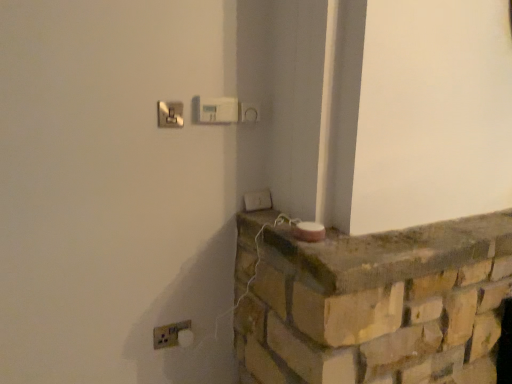
At what (x,y) coordinates should I click in order to perform the action: click on rustic stone ledge at center. Please return your answer as a coordinate pair (x, y). Image resolution: width=512 pixels, height=384 pixels. Looking at the image, I should click on (392, 252).

Find the location of a particular element. white plastic light switch at upper center, which is the first light switch from top to bottom is located at coordinates (217, 110).

What are the coordinates of `matte silver switch at upper center, acting as the 1th light switch starting from the front` in the screenshot? It's located at (170, 114).

The width and height of the screenshot is (512, 384). What do you see at coordinates (257, 200) in the screenshot?
I see `white plastic light switch at lower center, positioned as the first light switch in right-to-left order` at bounding box center [257, 200].

The image size is (512, 384). I want to click on white plastic electric outlet at lower left, so click(169, 334).

From the image's perspective, is matte silver switch at upper center, the 1th light switch in the left-to-right sequence, on white plastic electric outlet at lower left?

Correct, matte silver switch at upper center, the 1th light switch in the left-to-right sequence, appears higher than white plastic electric outlet at lower left in the image.

What's the angular difference between matte silver switch at upper center, the 3th light switch viewed from the right, and white plastic electric outlet at lower left's facing directions?

0.0309 degrees.

Which is behind, point (182, 110) or point (163, 327)?

Point (163, 327)

Does matte silver switch at upper center, which appears as the 3th light switch when viewed from the back, touch white plastic electric outlet at lower left?

There is a gap between matte silver switch at upper center, which appears as the 3th light switch when viewed from the back, and white plastic electric outlet at lower left.

From the image's perspective, would you say white plastic electric outlet at lower left is shown under white plastic light switch at upper center, which is the third light switch in bottom-to-top order?

Yes, from the image's perspective, white plastic electric outlet at lower left is beneath white plastic light switch at upper center, which is the third light switch in bottom-to-top order.

Is white plastic electric outlet at lower left inside or outside of white plastic light switch at upper center, placed as the second light switch when sorted from front to back?

white plastic electric outlet at lower left lies outside white plastic light switch at upper center, placed as the second light switch when sorted from front to back.

How much distance is there between white plastic electric outlet at lower left and white plastic light switch at upper center, which ranks as the second light switch in back-to-front order?

A distance of 32.73 inches exists between white plastic electric outlet at lower left and white plastic light switch at upper center, which ranks as the second light switch in back-to-front order.

From a real-world perspective, is white plastic electric outlet at lower left under white plastic light switch at upper center, which is the second light switch in right-to-left order?

Yes, from a real-world perspective, white plastic electric outlet at lower left is below white plastic light switch at upper center, which is the second light switch in right-to-left order.

Which is behind, point (165, 104) or point (347, 282)?

Point (165, 104)

Which is behind, matte silver switch at upper center, the 1th light switch in the left-to-right sequence, or rustic stone ledge at center?

matte silver switch at upper center, the 1th light switch in the left-to-right sequence, is more distant.

Is matte silver switch at upper center, the 3th light switch viewed from the right, not within rustic stone ledge at center?

Yes, matte silver switch at upper center, the 3th light switch viewed from the right, is located beyond the bounds of rustic stone ledge at center.

From a real-world perspective, is matte silver switch at upper center, the 1th light switch in the left-to-right sequence, over rustic stone ledge at center?

Correct, in the physical world, matte silver switch at upper center, the 1th light switch in the left-to-right sequence, is higher than rustic stone ledge at center.

Is white plastic light switch at lower center, the 1th light switch positioned from the bottom, wider than rustic stone ledge at center?

Incorrect, the width of white plastic light switch at lower center, the 1th light switch positioned from the bottom, does not surpass that of rustic stone ledge at center.

Would you say white plastic light switch at lower center, marked as the 3th light switch in a top-to-bottom arrangement, contains rustic stone ledge at center?

No, rustic stone ledge at center is not surrounded by white plastic light switch at lower center, marked as the 3th light switch in a top-to-bottom arrangement.

From the picture: Which is more distant, (244, 208) or (289, 266)?

The point (244, 208) is farther from the camera.

Is white plastic light switch at lower center, the 1th light switch positioned from the bottom, far away from rustic stone ledge at center?

No.

Does white plastic light switch at upper center, which is the third light switch in bottom-to-top order, appear on the left side of rustic stone ledge at center?

Correct, you'll find white plastic light switch at upper center, which is the third light switch in bottom-to-top order, to the left of rustic stone ledge at center.

From a real-world perspective, is white plastic light switch at upper center, which is the third light switch in bottom-to-top order, over rustic stone ledge at center?

Correct, in the physical world, white plastic light switch at upper center, which is the third light switch in bottom-to-top order, is higher than rustic stone ledge at center.

Is white plastic light switch at upper center, which is the second light switch in right-to-left order, aimed at rustic stone ledge at center?

No, white plastic light switch at upper center, which is the second light switch in right-to-left order, is not aimed at rustic stone ledge at center.

From a real-world perspective, is white plastic electric outlet at lower left positioned above or below matte silver switch at upper center, the 3th light switch viewed from the right?

white plastic electric outlet at lower left is situated lower than matte silver switch at upper center, the 3th light switch viewed from the right, in the real world.

Is white plastic electric outlet at lower left aimed at matte silver switch at upper center, the second light switch from the top?

No, white plastic electric outlet at lower left does not turn towards matte silver switch at upper center, the second light switch from the top.

Considering the points (180, 324) and (160, 119), which point is in front, point (180, 324) or point (160, 119)?

Point (160, 119)

From the image's perspective, does white plastic light switch at lower center, acting as the 3th light switch starting from the left, appear lower than matte silver switch at upper center, the second light switch from the top?

Correct, white plastic light switch at lower center, acting as the 3th light switch starting from the left, appears lower than matte silver switch at upper center, the second light switch from the top, in the image.

Is the position of white plastic light switch at lower center, the 1th light switch positioned from the bottom, more distant than that of matte silver switch at upper center, which appears as the 3th light switch when viewed from the back?

Yes, the depth of white plastic light switch at lower center, the 1th light switch positioned from the bottom, is greater than that of matte silver switch at upper center, which appears as the 3th light switch when viewed from the back.

Which is correct: white plastic light switch at lower center, acting as the 3th light switch starting from the left, is inside matte silver switch at upper center, the second light switch from the top, or outside of it?

white plastic light switch at lower center, acting as the 3th light switch starting from the left, exists outside the volume of matte silver switch at upper center, the second light switch from the top.

Are white plastic light switch at lower center, acting as the 3th light switch starting from the left, and matte silver switch at upper center, acting as the 1th light switch starting from the front, far apart?

white plastic light switch at lower center, acting as the 3th light switch starting from the left, is actually quite close to matte silver switch at upper center, acting as the 1th light switch starting from the front.

This screenshot has width=512, height=384. Find the location of `electric outlet behind the matte silver switch at upper center, acting as the 1th light switch starting from the front`. electric outlet behind the matte silver switch at upper center, acting as the 1th light switch starting from the front is located at coordinates (169, 334).

Where is `electric outlet below the white plastic light switch at upper center, which ranks as the second light switch in back-to-front order (from the image's perspective)`? This screenshot has width=512, height=384. electric outlet below the white plastic light switch at upper center, which ranks as the second light switch in back-to-front order (from the image's perspective) is located at coordinates (169, 334).

Which object lies further to the anchor point rustic stone ledge at center, matte silver switch at upper center, the 3th light switch viewed from the right, or white plastic electric outlet at lower left?

matte silver switch at upper center, the 3th light switch viewed from the right, lies further to rustic stone ledge at center than the other object.

When comparing their distances from white plastic light switch at lower center, acting as the 3th light switch starting from the left, does white plastic electric outlet at lower left or white plastic light switch at upper center, placed as the second light switch when sorted from front to back, seem further?

Based on the image, white plastic electric outlet at lower left appears to be further to white plastic light switch at lower center, acting as the 3th light switch starting from the left.

Which object lies further to the anchor point white plastic electric outlet at lower left, rustic stone ledge at center or white plastic light switch at lower center, marked as the 3th light switch in a top-to-bottom arrangement?

The object further to white plastic electric outlet at lower left is rustic stone ledge at center.

Considering their positions, is white plastic light switch at upper center, the second light switch from the left, positioned further to matte silver switch at upper center, the second light switch from the top, than white plastic light switch at lower center, acting as the 1th light switch starting from the back?

white plastic light switch at lower center, acting as the 1th light switch starting from the back, lies further to matte silver switch at upper center, the second light switch from the top, than the other object.

When comparing their distances from rustic stone ledge at center, does white plastic light switch at lower center, the 1th light switch positioned from the bottom, or white plastic electric outlet at lower left seem further?

The object further to rustic stone ledge at center is white plastic electric outlet at lower left.

Based on their spatial positions, is matte silver switch at upper center, the second light switch ordered from the bottom, or white plastic light switch at lower center, marked as the third light switch in a front-to-back arrangement, closer to white plastic light switch at upper center, which is the third light switch in bottom-to-top order?

matte silver switch at upper center, the second light switch ordered from the bottom.

From the image, which object appears to be farther from white plastic electric outlet at lower left, white plastic light switch at upper center, which is the third light switch in bottom-to-top order, or rustic stone ledge at center?

white plastic light switch at upper center, which is the third light switch in bottom-to-top order.

Looking at the image, which one is located closer to white plastic light switch at lower center, marked as the 3th light switch in a top-to-bottom arrangement, white plastic light switch at upper center, the second light switch from the left, or rustic stone ledge at center?

white plastic light switch at upper center, the second light switch from the left, lies closer to white plastic light switch at lower center, marked as the 3th light switch in a top-to-bottom arrangement, than the other object.

Find the location of `light switch between matte silver switch at upper center, which appears as the 3th light switch when viewed from the back, and white plastic electric outlet at lower left in the up-down direction`. light switch between matte silver switch at upper center, which appears as the 3th light switch when viewed from the back, and white plastic electric outlet at lower left in the up-down direction is located at coordinates (257, 200).

Where is `light switch between white plastic light switch at upper center, which ranks as the second light switch in back-to-front order, and white plastic light switch at lower center, marked as the 3th light switch in a top-to-bottom arrangement, vertically`? This screenshot has height=384, width=512. light switch between white plastic light switch at upper center, which ranks as the second light switch in back-to-front order, and white plastic light switch at lower center, marked as the 3th light switch in a top-to-bottom arrangement, vertically is located at coordinates (170, 114).

The width and height of the screenshot is (512, 384). In order to click on light switch located between white plastic light switch at upper center, which is the first light switch from top to bottom, and rustic stone ledge at center in the left-right direction in this screenshot , I will do `click(257, 200)`.